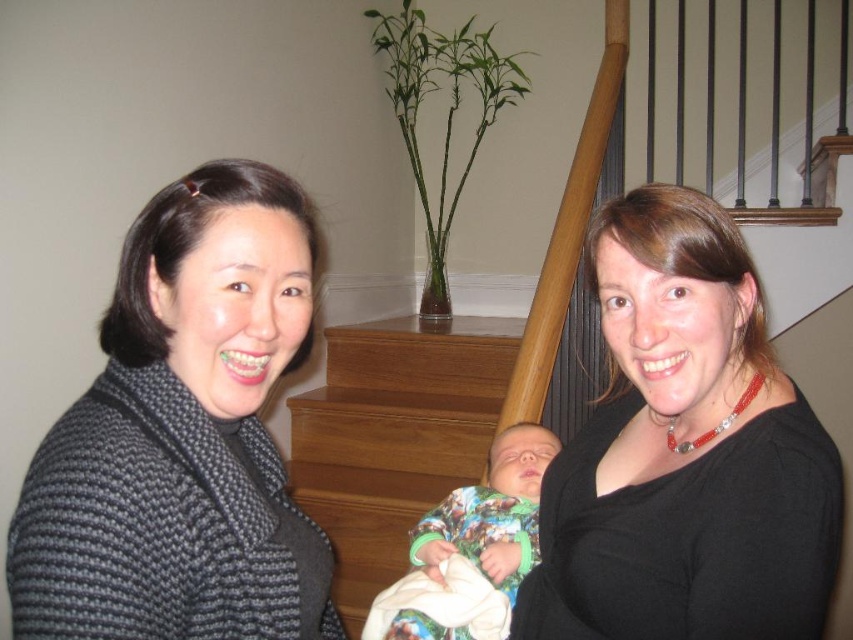
Question: Does black matte shirt at right appear over wooden stairs at center?

Choices:
 (A) yes
 (B) no

Answer: (A)

Question: Among these objects, which one is nearest to the camera?

Choices:
 (A) printed cotton onesie at center
 (B) black matte shirt at right

Answer: (B)

Question: Does knitted gray sweater at left lie behind wooden stairs at center?

Choices:
 (A) yes
 (B) no

Answer: (B)

Question: Can you confirm if black matte shirt at right is thinner than printed cotton onesie at center?

Choices:
 (A) no
 (B) yes

Answer: (B)

Question: Which of the following is the closest to the observer?

Choices:
 (A) (445, 472)
 (B) (527, 548)
 (C) (258, 387)

Answer: (C)

Question: Estimate the real-world distances between objects in this image. Which object is farther from the knitted gray sweater at left?

Choices:
 (A) black matte shirt at right
 (B) printed cotton onesie at center
 (C) wooden stairs at center

Answer: (C)